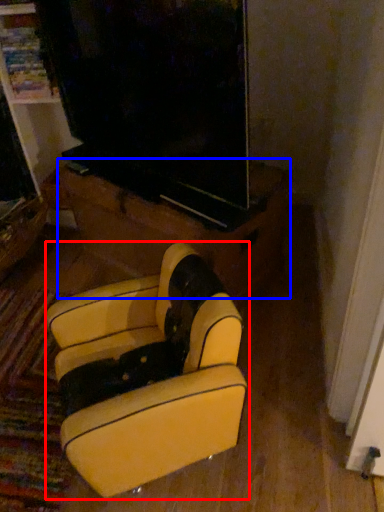
Question: Which object is further to the camera taking this photo, furniture (highlighted by a red box) or furniture (highlighted by a blue box)?

Choices:
 (A) furniture
 (B) furniture

Answer: (B)